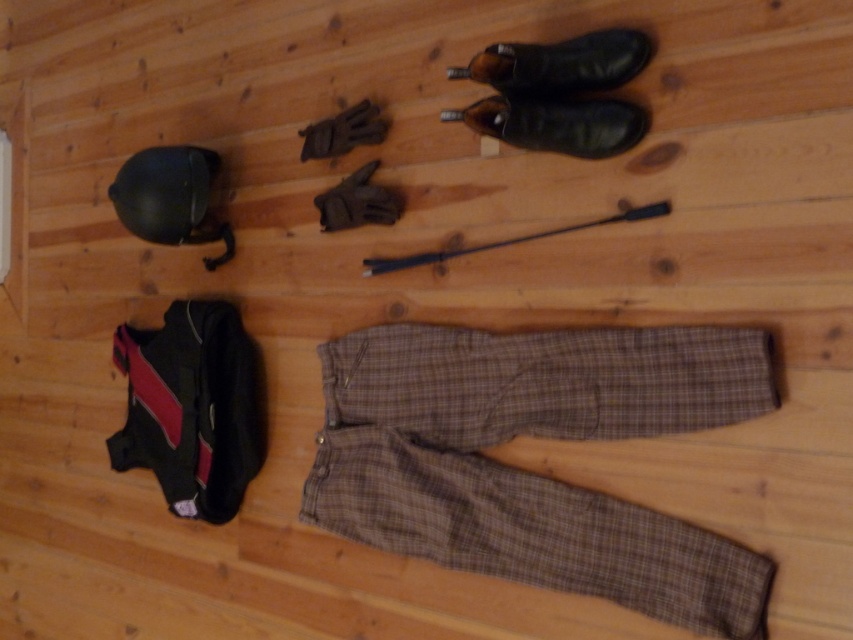
Which is above, brown plaid pants at center or leather boot at upper center?

leather boot at upper center is above.

Can you confirm if brown plaid pants at center is positioned below leather boot at upper center?

Yes, brown plaid pants at center is below leather boot at upper center.

This screenshot has height=640, width=853. In order to click on brown plaid pants at center in this screenshot , I will do click(531, 472).

Measure the distance between point [146,208] and camera.

A distance of 5.30 feet exists between point [146,208] and camera.

How far apart are matte black helmet at upper left and leather boot at upper center?

matte black helmet at upper left and leather boot at upper center are 31.09 inches apart.

Between point (125, 170) and point (608, 64), which one is positioned in front?

Positioned in front is point (608, 64).

The height and width of the screenshot is (640, 853). In order to click on matte black helmet at upper left in this screenshot , I will do `click(171, 198)`.

How far apart are leather boot at upper center and leather shoe at upper center?

leather boot at upper center is 2.69 inches away from leather shoe at upper center.

Who is higher up, leather boot at upper center or leather shoe at upper center?

Positioned higher is leather boot at upper center.

The height and width of the screenshot is (640, 853). I want to click on leather boot at upper center, so click(560, 64).